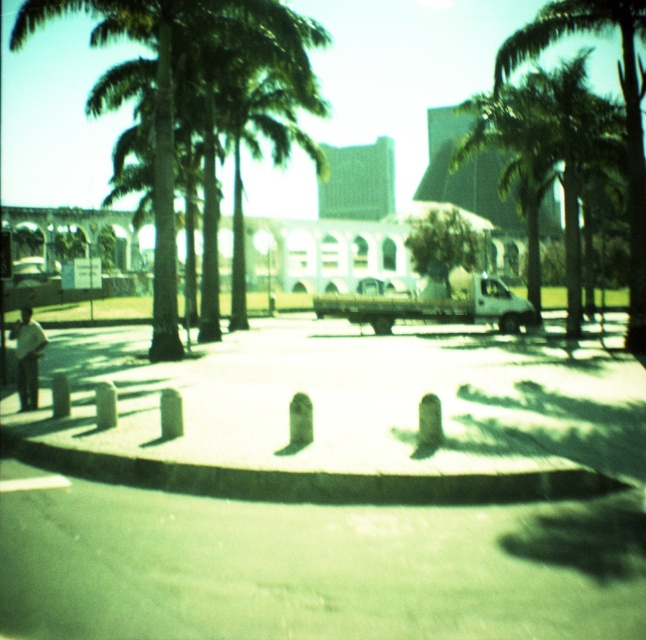
Between point (550, 40) and point (474, 289), which one is positioned in front?

Point (550, 40) is in front.

The image size is (646, 640). I want to click on green leafy palm tree at upper right, so click(x=623, y=109).

Can you confirm if green leafy palm tree at center is positioned to the left of white cotton shirt at left?

No, green leafy palm tree at center is not to the left of white cotton shirt at left.

Which is behind, point (169, 138) or point (26, 312)?

Positioned behind is point (169, 138).

Where is `green leafy palm tree at center`? This screenshot has width=646, height=640. green leafy palm tree at center is located at coordinates (172, 88).

The image size is (646, 640). Find the location of `white matte truck at center`. white matte truck at center is located at coordinates (432, 307).

Between white matte truck at center and white cotton shirt at left, which one is positioned lower?

white cotton shirt at left

Who is more distant from viewer, (317, 304) or (45, 337)?

Positioned behind is point (317, 304).

In order to click on white matte truck at center in this screenshot , I will do `click(432, 307)`.